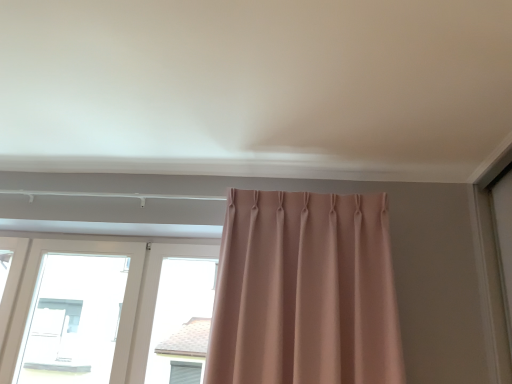
Question: From a real-world perspective, is white plastic window at left physically located above or below matte pink curtain at center?

Choices:
 (A) below
 (B) above

Answer: (A)

Question: Is white plastic window at left bigger or smaller than matte pink curtain at center?

Choices:
 (A) small
 (B) big

Answer: (B)

Question: Is white plastic window at left inside the boundaries of matte pink curtain at center, or outside?

Choices:
 (A) inside
 (B) outside

Answer: (B)

Question: From a real-world perspective, is matte pink curtain at center positioned above or below white plastic window at left?

Choices:
 (A) below
 (B) above

Answer: (B)

Question: Is matte pink curtain at center in front of or behind white plastic window at left in the image?

Choices:
 (A) behind
 (B) front

Answer: (B)

Question: Do you think matte pink curtain at center is within white plastic window at left, or outside of it?

Choices:
 (A) outside
 (B) inside

Answer: (A)

Question: From their relative heights in the image, would you say matte pink curtain at center is taller or shorter than white plastic window at left?

Choices:
 (A) tall
 (B) short

Answer: (A)